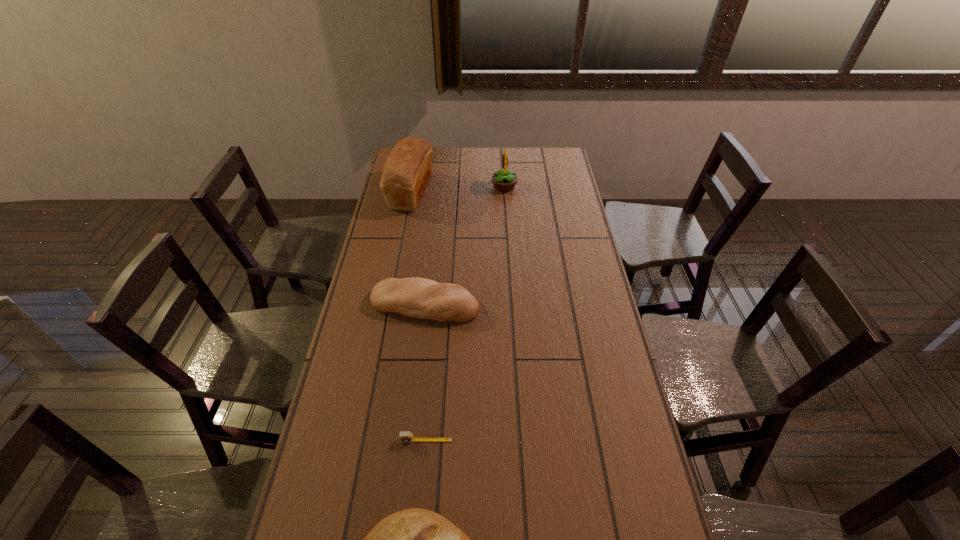
At what (x,y) coordinates should I click in order to perform the action: click on vacant space that is in between the sunflower and the tallest bread. Please return your answer as a coordinate pair (x, y). The height and width of the screenshot is (540, 960). Looking at the image, I should click on (458, 189).

This screenshot has height=540, width=960. I want to click on vacant point located between the sunflower and the tallest bread, so click(x=458, y=189).

Select which object appears as the third closest to the tape measure. Please provide its 2D coordinates. Your answer should be formatted as a tuple, i.e. [(x, y)], where the tuple contains the x and y coordinates of a point satisfying the conditions above.

[(408, 167)]

At what (x,y) coordinates should I click in order to perform the action: click on the fourth closest object to the farthest bread. Please return your answer as a coordinate pair (x, y). This screenshot has width=960, height=540. Looking at the image, I should click on (415, 539).

Image resolution: width=960 pixels, height=540 pixels. Find the location of `bread that is the closest to the shortest object`. bread that is the closest to the shortest object is located at coordinates (415, 539).

Choose which bread is the nearest neighbor to the third farthest object. Please provide its 2D coordinates. Your answer should be formatted as a tuple, i.e. [(x, y)], where the tuple contains the x and y coordinates of a point satisfying the conditions above.

[(408, 167)]

This screenshot has width=960, height=540. I want to click on free region that satisfies the following two spatial constraints: 1. on the face of the sunflower; 2. at the front of the shortest object with the tape extended, so click(x=521, y=440).

Identify the location of free point that satisfies the following two spatial constraints: 1. on the face of the rightmost object; 2. at the front of the shortest object with the tape extended. The width and height of the screenshot is (960, 540). (521, 440).